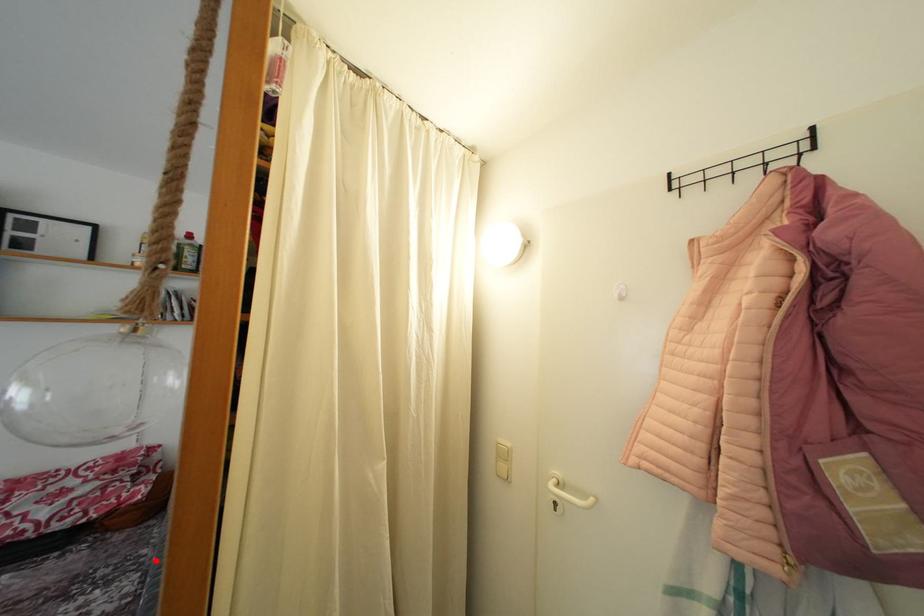
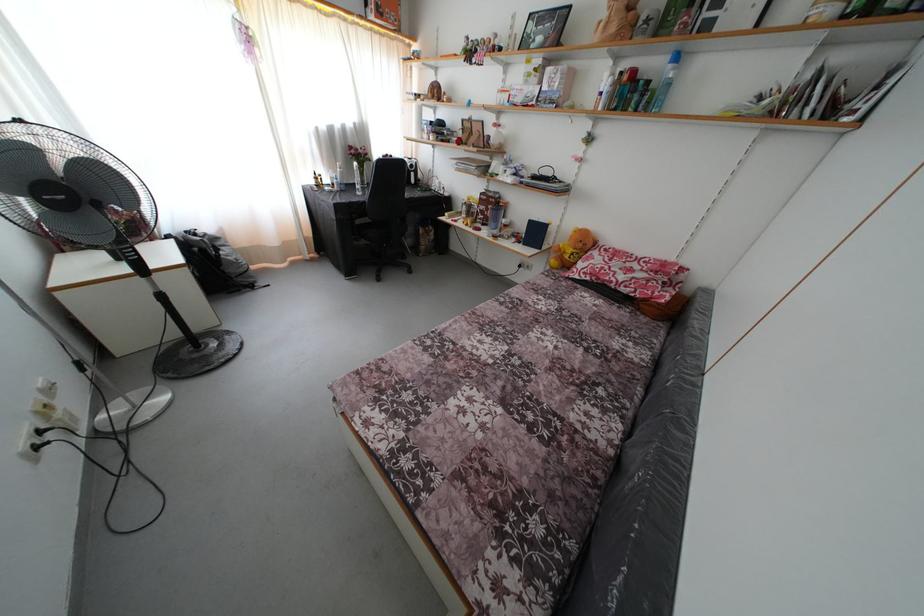
Where in the second image is the point corresponding to the highlighted location from the first image?

(663, 353)